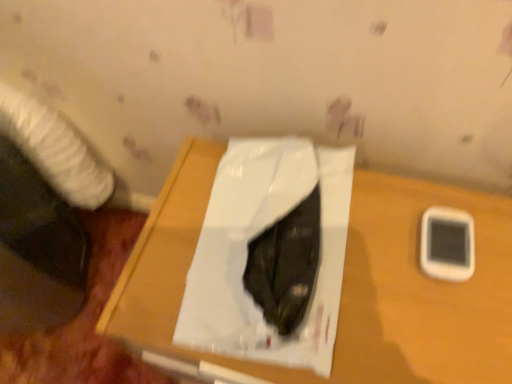
Question: Can you confirm if white plastic mobile phone at right is thinner than white glossy paper at center?

Choices:
 (A) no
 (B) yes

Answer: (B)

Question: From the image's perspective, is white plastic mobile phone at right over white glossy paper at center?

Choices:
 (A) yes
 (B) no

Answer: (B)

Question: Considering the relative sizes of white plastic mobile phone at right and white glossy paper at center in the image provided, is white plastic mobile phone at right smaller than white glossy paper at center?

Choices:
 (A) no
 (B) yes

Answer: (B)

Question: Is white plastic mobile phone at right positioned far away from white glossy paper at center?

Choices:
 (A) no
 (B) yes

Answer: (A)

Question: Does white plastic mobile phone at right lie behind white glossy paper at center?

Choices:
 (A) yes
 (B) no

Answer: (A)

Question: Is white plastic mobile phone at right inside the boundaries of white glossy paper at center, or outside?

Choices:
 (A) inside
 (B) outside

Answer: (B)

Question: Does point (436, 208) appear closer or farther from the camera than point (242, 281)?

Choices:
 (A) closer
 (B) farther

Answer: (B)

Question: Is white plastic mobile phone at right in front of or behind white glossy paper at center in the image?

Choices:
 (A) behind
 (B) front

Answer: (A)

Question: Is white plastic mobile phone at right wider or thinner than white glossy paper at center?

Choices:
 (A) wide
 (B) thin

Answer: (B)

Question: From the image's perspective, is white plastic mobile phone at right positioned above or below wooden table at center?

Choices:
 (A) above
 (B) below

Answer: (A)

Question: Considering the positions of point (429, 249) and point (407, 367), is point (429, 249) closer or farther from the camera than point (407, 367)?

Choices:
 (A) farther
 (B) closer

Answer: (A)

Question: Considering the positions of white plastic mobile phone at right and wooden table at center in the image, is white plastic mobile phone at right taller or shorter than wooden table at center?

Choices:
 (A) short
 (B) tall

Answer: (A)

Question: Is white plastic mobile phone at right wider or thinner than wooden table at center?

Choices:
 (A) wide
 (B) thin

Answer: (B)

Question: Considering the positions of white glossy paper at center and wooden table at center in the image, is white glossy paper at center taller or shorter than wooden table at center?

Choices:
 (A) short
 (B) tall

Answer: (A)

Question: Considering their positions, is white glossy paper at center located in front of or behind wooden table at center?

Choices:
 (A) front
 (B) behind

Answer: (B)